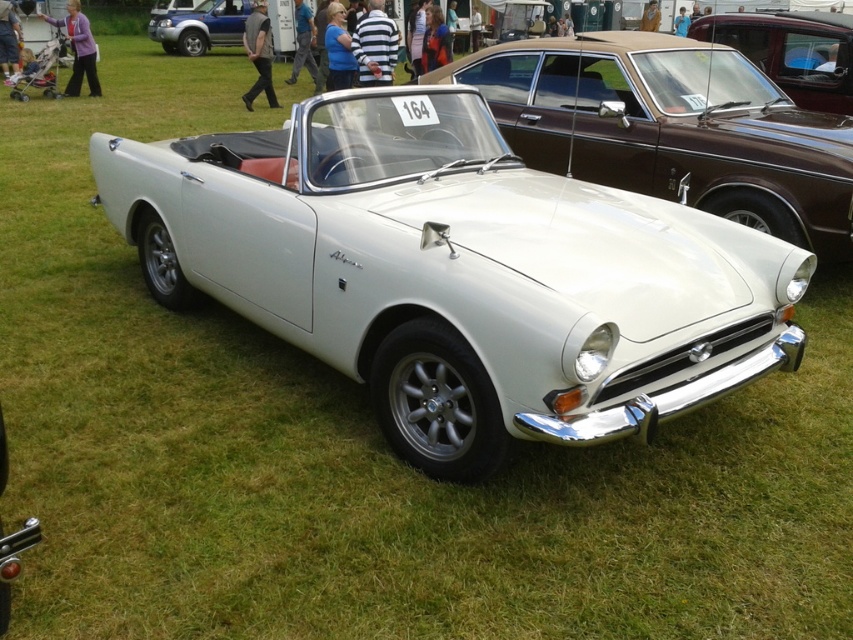
Is white glossy convertible at center taller than shiny brown car at upper right?

Correct, white glossy convertible at center is much taller as shiny brown car at upper right.

Is white glossy convertible at center shorter than shiny brown car at upper right?

No.

Is point (663, 156) closer to camera compared to point (792, 29)?

That is True.

I want to click on white glossy convertible at center, so click(671, 129).

Between shiny brown car at upper right and matte blue suv at upper left, which one has more height?

With more height is matte blue suv at upper left.

Between shiny brown car at upper right and matte blue suv at upper left, which one appears on the right side from the viewer's perspective?

From the viewer's perspective, shiny brown car at upper right appears more on the right side.

Does point (838, 84) come farther from viewer compared to point (229, 0)?

No.

I want to click on shiny brown car at upper right, so click(x=791, y=51).

Between point (647, 68) and point (234, 6), which one is positioned in front?

Point (647, 68)

Describe the element at coordinates (671, 129) in the screenshot. I see `white glossy convertible at center` at that location.

Is point (723, 166) positioned behind point (177, 29)?

No, it is in front of (177, 29).

Where is `white glossy convertible at center`? The height and width of the screenshot is (640, 853). white glossy convertible at center is located at coordinates (671, 129).